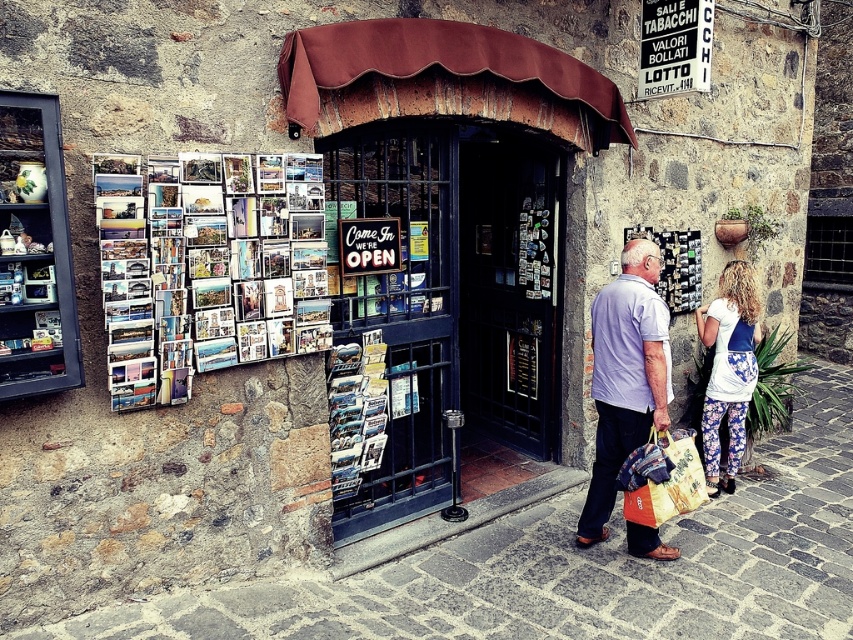
You are a customer entering the store and see the light purple cotton shirt at center and the floral leggings at lower right. Which item is closer to the entrance?

The light purple cotton shirt at center is closer to the entrance because it is positioned under the floral leggings at lower right, meaning it is lower in the image and thus nearer to the entrance located at the bottom of the scene.

You are standing in front of the storefront and want to take a photo of the printed paper collage at upper left. Where should you position your camera to capture it in the frame?

The printed paper collage at upper left is located at point 0.420 on the x axis and 0.254 on the y axis, so position your camera to focus on that coordinate to capture it in the frame.